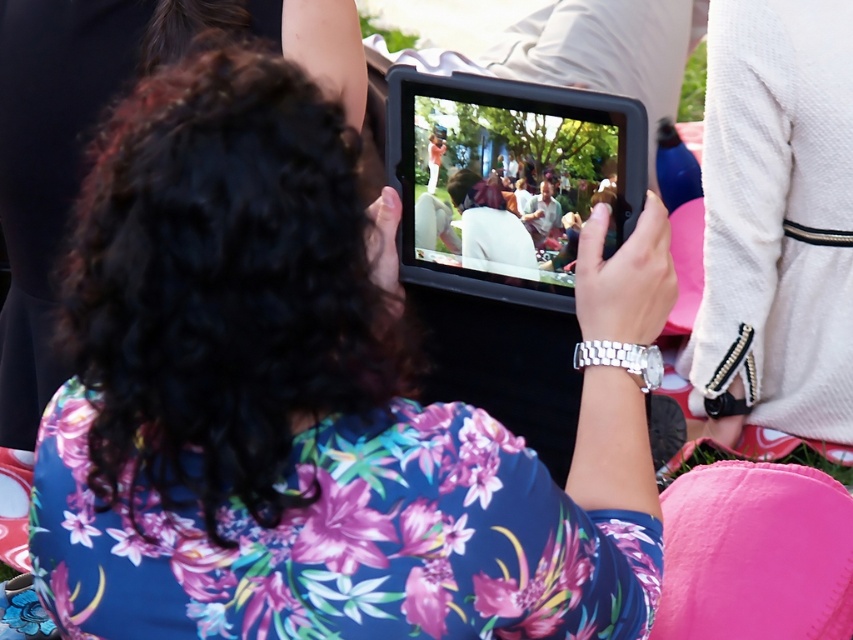
Question: Which object appears closest to the camera in this image?

Choices:
 (A) floral fabric shirt at center
 (B) black matte tablet at center

Answer: (A)

Question: Is floral fabric shirt at center bigger than black matte tablet at center?

Choices:
 (A) yes
 (B) no

Answer: (A)

Question: Which object appears closest to the camera in this image?

Choices:
 (A) black matte tablet at center
 (B) floral fabric shirt at center

Answer: (B)

Question: Where is floral fabric shirt at center located in relation to black matte tablet at center in the image?

Choices:
 (A) below
 (B) above

Answer: (A)

Question: Can you confirm if floral fabric shirt at center is positioned to the right of black matte tablet at center?

Choices:
 (A) no
 (B) yes

Answer: (A)